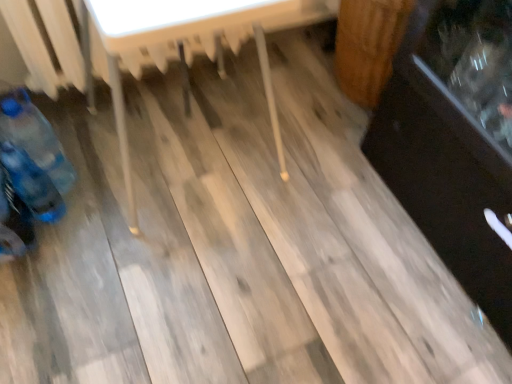
You are a GUI agent. You are given a task and a screenshot of the screen. Output one action in this format:
    pyautogui.click(x=<x>, y=<y>)
    Task: Click on the free location to the right of blue plastic bottle at left, arranged as the 1th bottle when viewed from the top
    
    Given the screenshot: What is the action you would take?
    pyautogui.click(x=101, y=191)